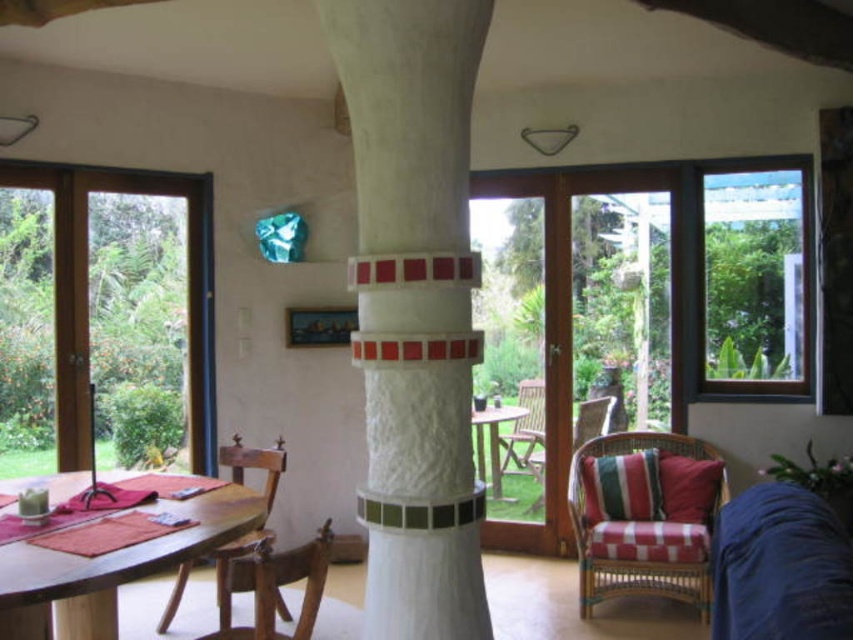
Who is taller, white textured column at center or wooden table at center?

With more height is white textured column at center.

Who is lower down, white textured column at center or wooden table at center?

Positioned lower is wooden table at center.

Is point (381, 392) positioned after point (489, 477)?

That is False.

Where is `white textured column at center`? The image size is (853, 640). white textured column at center is located at coordinates (415, 307).

Can you confirm if woven rattan armchair at lower right is smaller than striped fabric armchair at center?

No.

Can you confirm if woven rattan armchair at lower right is positioned to the right of striped fabric armchair at center?

Correct, you'll find woven rattan armchair at lower right to the right of striped fabric armchair at center.

Does point (579, 499) lie in front of point (531, 417)?

That is True.

Identify the location of woven rattan armchair at lower right. The height and width of the screenshot is (640, 853). (641, 531).

Does point (53, 592) lie behind point (288, 636)?

No, it is not.

Who is lower down, wooden table at lower left or wooden armchair at lower left?

wooden table at lower left

Where is `wooden table at lower left`? wooden table at lower left is located at coordinates (111, 568).